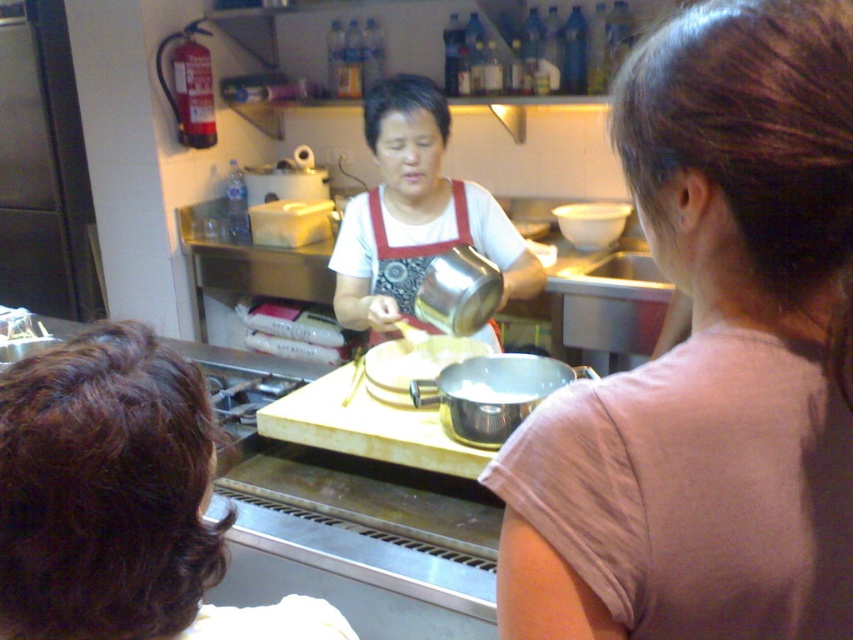
From the picture: Between matte white apron at center and brown curly hair at lower left, which one has less height?

With less height is brown curly hair at lower left.

Between matte white apron at center and brown curly hair at lower left, which one is positioned lower?

brown curly hair at lower left is lower down.

Identify the location of matte white apron at center. (711, 358).

The height and width of the screenshot is (640, 853). In order to click on matte white apron at center in this screenshot , I will do `click(711, 358)`.